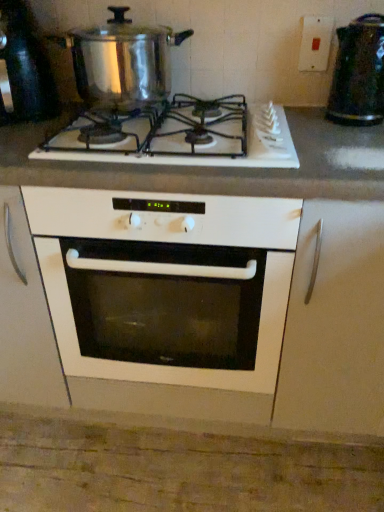
The width and height of the screenshot is (384, 512). I want to click on empty space that is ontop of white matte cabinet door at right, so click(345, 138).